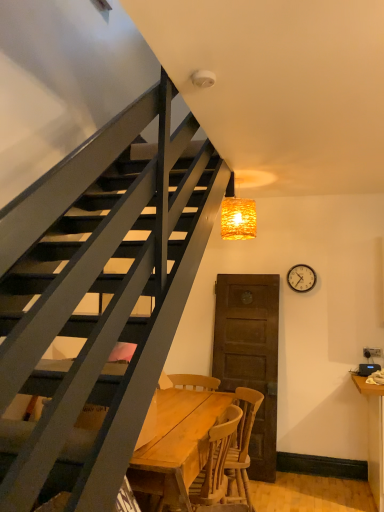
Question: From a real-world perspective, does wooden table at center stand above woven golden light at upper center?

Choices:
 (A) yes
 (B) no

Answer: (B)

Question: Is wooden table at center shorter than woven golden light at upper center?

Choices:
 (A) yes
 (B) no

Answer: (B)

Question: Would you say wooden table at center contains woven golden light at upper center?

Choices:
 (A) no
 (B) yes

Answer: (A)

Question: Is wooden table at center thinner than woven golden light at upper center?

Choices:
 (A) yes
 (B) no

Answer: (B)

Question: Does wooden table at center appear on the left side of woven golden light at upper center?

Choices:
 (A) yes
 (B) no

Answer: (A)

Question: From a real-world perspective, is metallic silver clock at upper right positioned above or below wooden chair at center?

Choices:
 (A) below
 (B) above

Answer: (B)

Question: Is point (289, 271) closer or farther from the camera than point (243, 506)?

Choices:
 (A) closer
 (B) farther

Answer: (B)

Question: In terms of width, does metallic silver clock at upper right look wider or thinner when compared to wooden chair at center?

Choices:
 (A) thin
 (B) wide

Answer: (A)

Question: Considering the positions of metallic silver clock at upper right and wooden chair at center in the image, is metallic silver clock at upper right taller or shorter than wooden chair at center?

Choices:
 (A) tall
 (B) short

Answer: (B)

Question: From the image's perspective, is woven golden light at upper center located above or below wooden chair at center?

Choices:
 (A) below
 (B) above

Answer: (B)

Question: Is point (253, 208) closer or farther from the camera than point (216, 449)?

Choices:
 (A) farther
 (B) closer

Answer: (A)

Question: Is woven golden light at upper center spatially inside wooden chair at center, or outside of it?

Choices:
 (A) inside
 (B) outside

Answer: (B)

Question: Relative to wooden chair at center, is woven golden light at upper center in front or behind?

Choices:
 (A) behind
 (B) front

Answer: (A)

Question: In the image, is metallic silver clock at upper right positioned in front of or behind woven golden light at upper center?

Choices:
 (A) behind
 (B) front

Answer: (A)

Question: From a real-world perspective, is metallic silver clock at upper right physically located above or below woven golden light at upper center?

Choices:
 (A) below
 (B) above

Answer: (A)